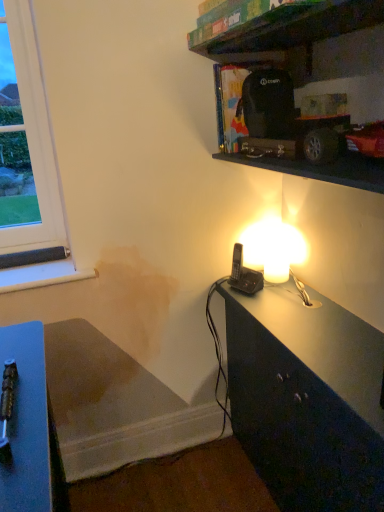
Question: Is wooden bookshelf at upper center next to black plastic phone at right and touching it?

Choices:
 (A) no
 (B) yes

Answer: (A)

Question: Is black plastic phone at right completely or partially inside wooden bookshelf at upper center?

Choices:
 (A) no
 (B) yes

Answer: (A)

Question: From a real-world perspective, is wooden bookshelf at upper center on top of black plastic phone at right?

Choices:
 (A) yes
 (B) no

Answer: (A)

Question: Is wooden bookshelf at upper center not near black plastic phone at right?

Choices:
 (A) no
 (B) yes

Answer: (A)

Question: Is wooden bookshelf at upper center at the right side of black plastic phone at right?

Choices:
 (A) yes
 (B) no

Answer: (A)

Question: Is wooden bookshelf at upper center not within black plastic phone at right?

Choices:
 (A) yes
 (B) no

Answer: (A)

Question: Is black plastic phone at right to the left of wooden bookshelf at upper center from the viewer's perspective?

Choices:
 (A) no
 (B) yes

Answer: (B)

Question: Is black plastic phone at right oriented away from wooden bookshelf at upper center?

Choices:
 (A) yes
 (B) no

Answer: (B)

Question: Are black plastic phone at right and wooden bookshelf at upper center located far from each other?

Choices:
 (A) yes
 (B) no

Answer: (B)

Question: Can you confirm if black plastic phone at right is taller than wooden bookshelf at upper center?

Choices:
 (A) no
 (B) yes

Answer: (B)

Question: Is the position of black plastic phone at right more distant than that of wooden bookshelf at upper center?

Choices:
 (A) no
 (B) yes

Answer: (B)

Question: Is black plastic phone at right bigger than wooden bookshelf at upper center?

Choices:
 (A) yes
 (B) no

Answer: (B)

Question: Considering the relative positions of wooden bookshelf at upper center and black plastic phone at right in the image provided, is wooden bookshelf at upper center to the left or to the right of black plastic phone at right?

Choices:
 (A) left
 (B) right

Answer: (B)